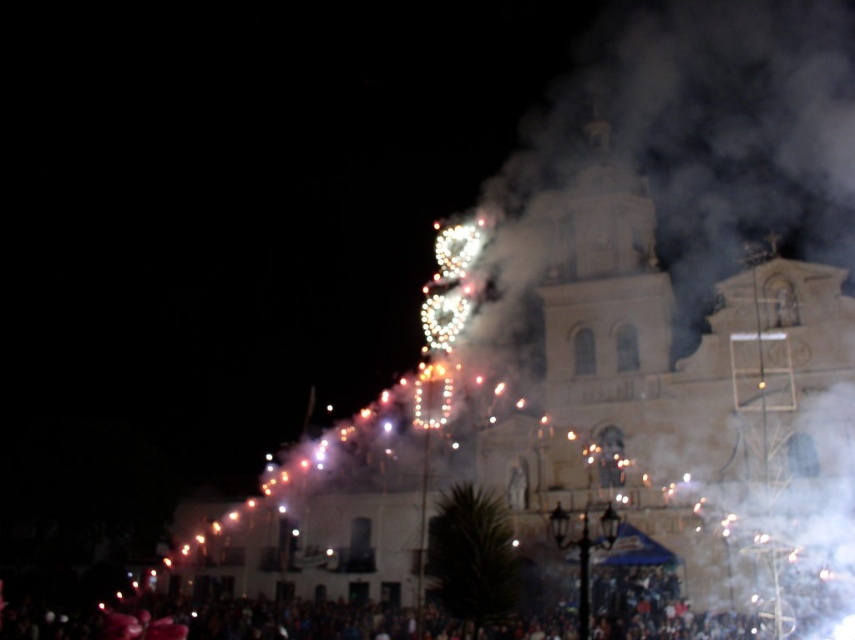
Question: Is white stone church at center below dark clothing crowd at lower center?

Choices:
 (A) no
 (B) yes

Answer: (A)

Question: Does white stone church at center have a larger size compared to dark clothing crowd at lower center?

Choices:
 (A) no
 (B) yes

Answer: (B)

Question: From the image, what is the correct spatial relationship of white stone church at center in relation to dark clothing crowd at lower center?

Choices:
 (A) left
 (B) right

Answer: (B)